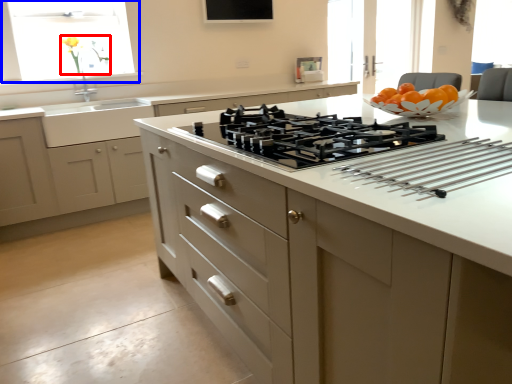
Question: Which object appears farthest to the camera in this image, flower (highlighted by a red box) or window (highlighted by a blue box)?

Choices:
 (A) flower
 (B) window

Answer: (A)